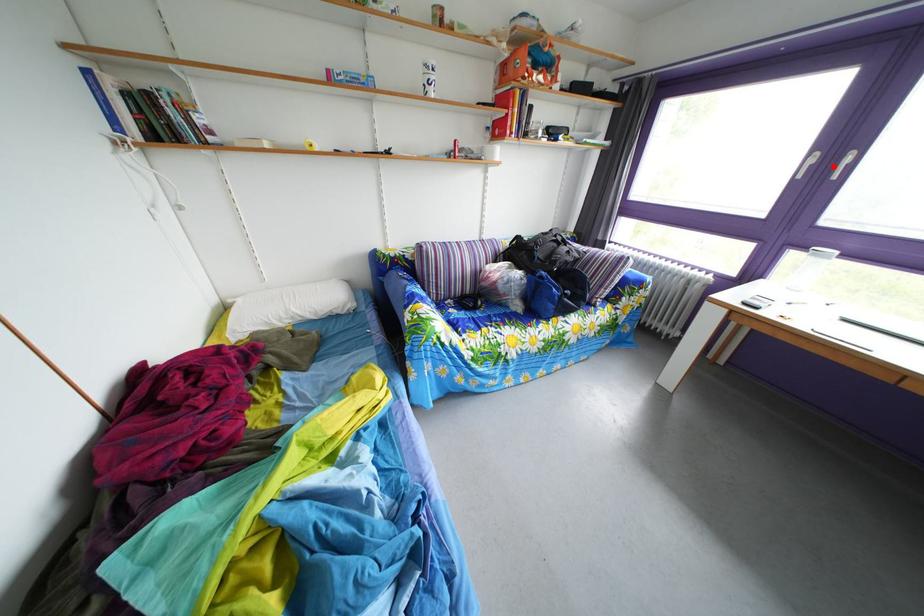
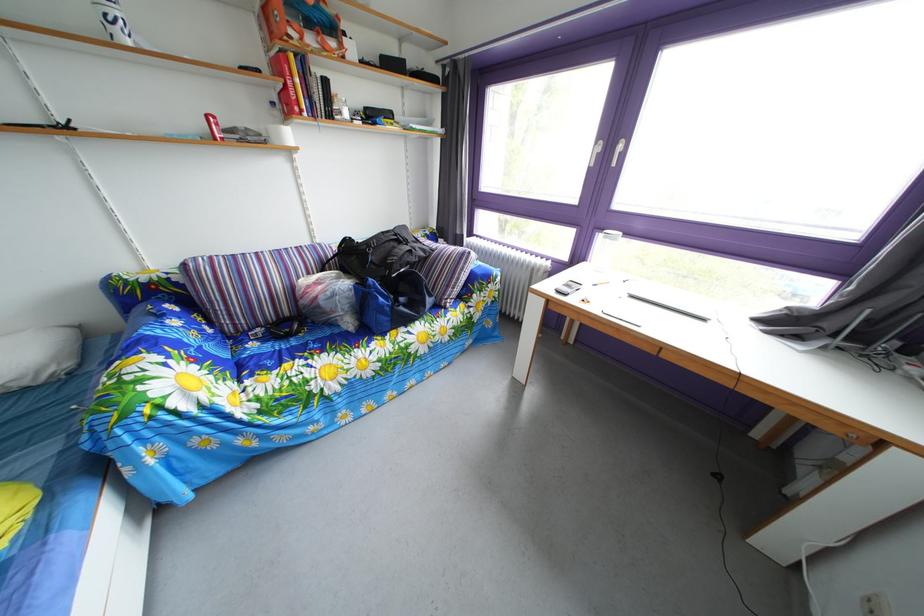
Question: I am providing you with two images of the same scene from different viewpoints. A red point is shown in image1. For the corresponding object point in image2, is it positioned nearer or farther from the camera?

Choices:
 (A) Nearer
 (B) Farther

Answer: (A)